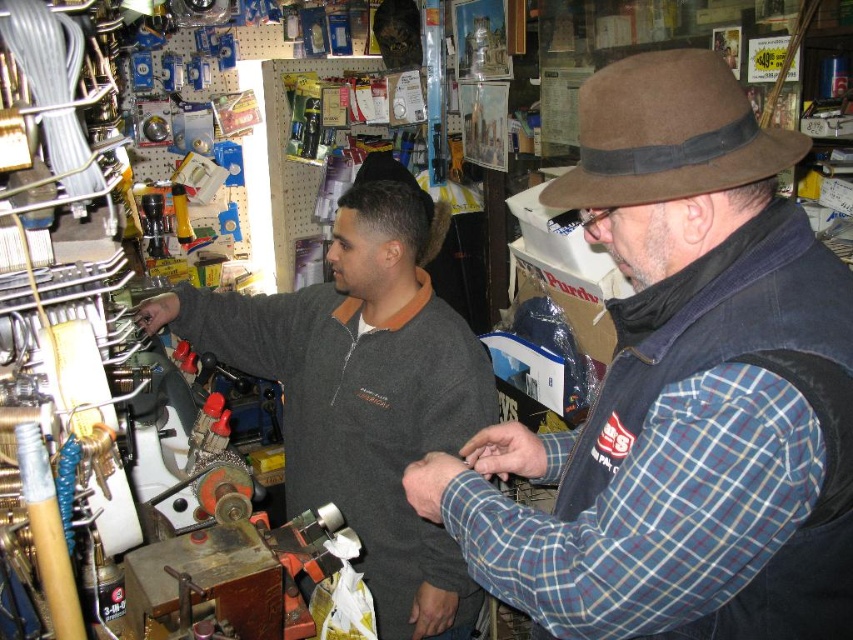
You are a customer in the hardware store looking for a specific tool. You see the dark gray sweater at center and the brown suede fedora at upper right. Which object is closer to you?

The dark gray sweater at center is closer to you because the brown suede fedora at upper right is behind it.

You are a customer in the hardware store looking for a hat to buy. You see both the brown felt hat at upper right and the brown suede fedora at upper right. Which one is closer to you?

The brown felt hat at upper right is closer to you because it is in front of the brown suede fedora at upper right.

You are a customer in the hardware store looking for a hat to buy. You see the brown felt hat at upper right and the dark gray sweater at center. Which item is located higher up?

The brown felt hat at upper right is above the dark gray sweater at center, so it is located higher up.